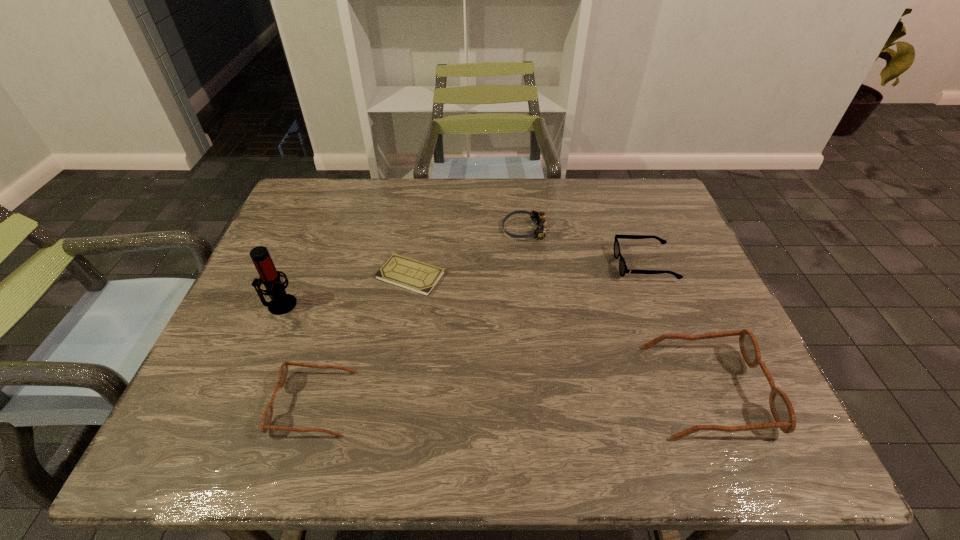
Please point a location where one more spectacles can be added evenly. Please provide its 2D coordinates. Your answer should be formatted as a tuple, i.e. [(x, y)], where the tuple contains the x and y coordinates of a point satisfying the conditions above.

[(513, 396)]